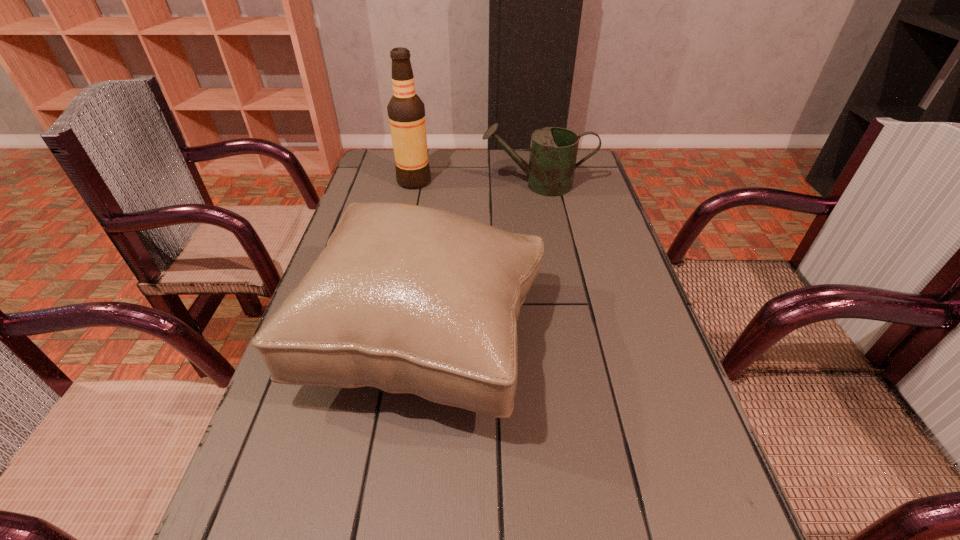
This screenshot has height=540, width=960. I want to click on vacant area that lies between the alcohol and the watering can, so click(x=476, y=183).

Locate an element on the screen. This screenshot has height=540, width=960. object that can be found as the second closest to the tallest object is located at coordinates (408, 299).

The image size is (960, 540). I want to click on object that stands as the second closest to the shortest object, so click(x=408, y=299).

Image resolution: width=960 pixels, height=540 pixels. Identify the location of vacant space that satisfies the following two spatial constraints: 1. on the label of the tallest object; 2. on the left side of the cushion. (380, 339).

You are a GUI agent. You are given a task and a screenshot of the screen. Output one action in this format:
    pyautogui.click(x=<x>, y=<y>)
    Task: Click on the vacant point that satisfies the following two spatial constraints: 1. on the label of the alcohol; 2. on the back side of the cushion
    This screenshot has width=960, height=540.
    Given the screenshot: What is the action you would take?
    pyautogui.click(x=380, y=339)